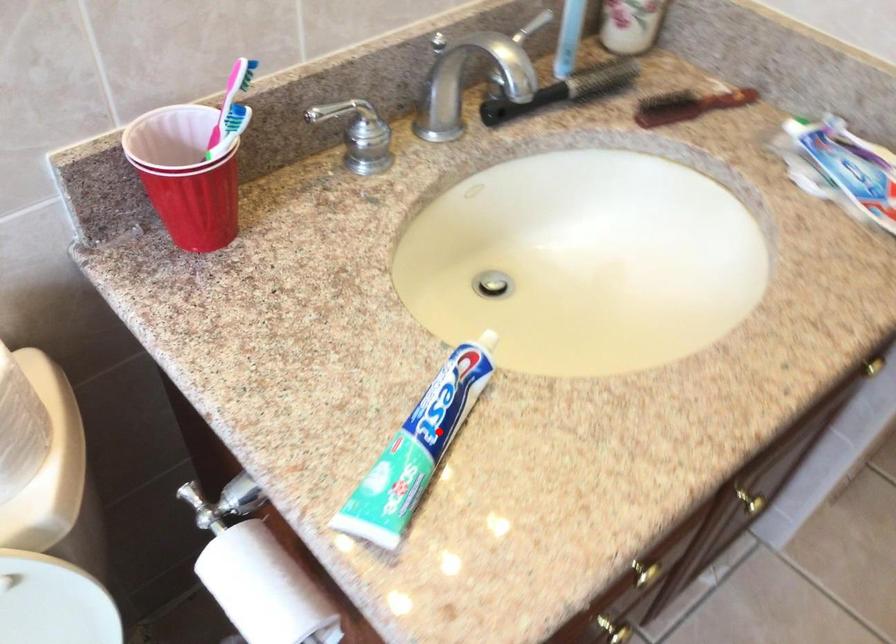
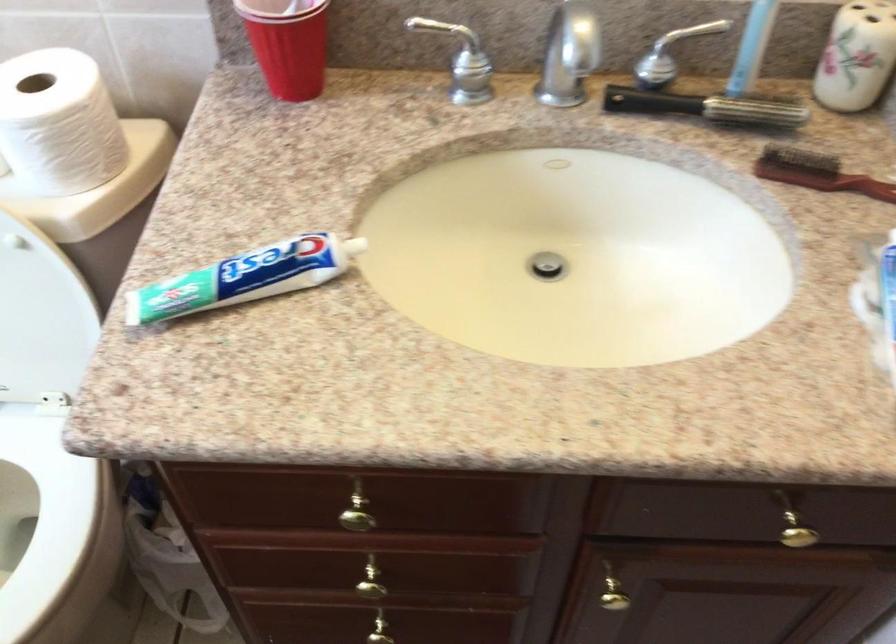
Find the pixel in the second image that matches the highlighted location in the first image.

(245, 277)